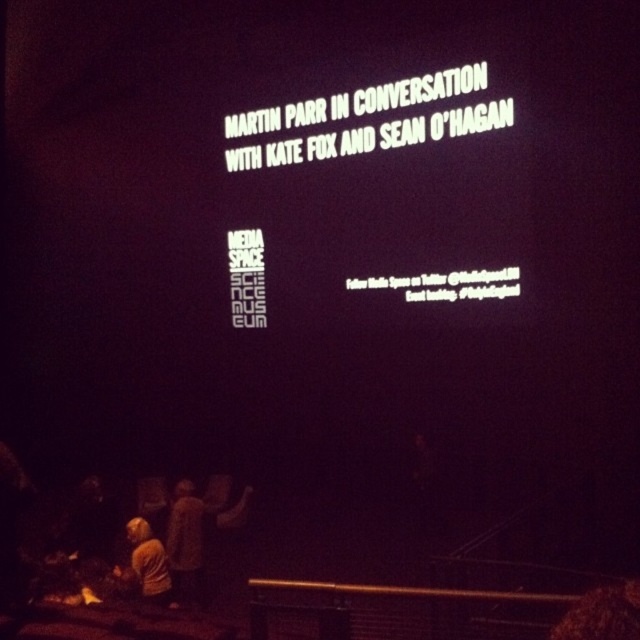
You are an event organizer setting up chairs for an audience. You have two fabrics, the dark brown fabric at lower left and the yellow fabric at lower left. Which fabric should you choose if you need a larger one to cover a bigger area?

The dark brown fabric at lower left is larger in size than the yellow fabric at lower left, so you should choose the dark brown fabric at lower left to cover a bigger area.

You are an event organizer who needs to adjust the lighting for a presentation. The white text on black screen at center is currently too bright compared to the dark brown fabric at lower left. To ensure the text remains visible but doesn not overpower the fabric, what adjustment should you make?

You should lower the brightness of the white text on black screen at center so it doesn not completely overshadow the dark brown fabric at lower left while keeping the text legible.